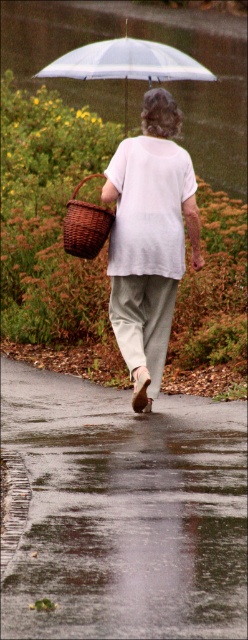
Question: Does glossy asphalt pavement at lower center have a greater width compared to transparent plastic umbrella at upper center?

Choices:
 (A) yes
 (B) no

Answer: (B)

Question: Which point is closer to the camera?

Choices:
 (A) brown woven basket at center
 (B) transparent plastic umbrella at upper center
 (C) white cotton shirt at center

Answer: (C)

Question: Which point is farther to the camera?

Choices:
 (A) white cotton shirt at center
 (B) glossy asphalt pavement at lower center

Answer: (A)

Question: Among these objects, which one is farthest from the camera?

Choices:
 (A) transparent plastic umbrella at upper center
 (B) brown woven basket at center

Answer: (A)

Question: Is glossy asphalt pavement at lower center smaller than white cotton shirt at center?

Choices:
 (A) no
 (B) yes

Answer: (B)

Question: Does glossy asphalt pavement at lower center lie behind white cotton shirt at center?

Choices:
 (A) yes
 (B) no

Answer: (B)